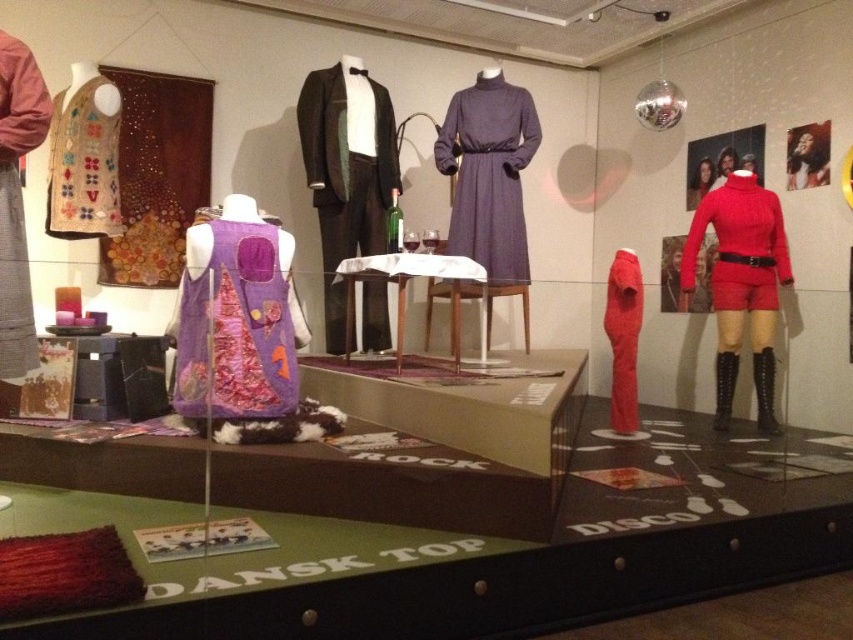
Does shiny black tuxedo at center have a smaller size compared to textured wool vest at left?

Incorrect, shiny black tuxedo at center is not smaller in size than textured wool vest at left.

Is point (376, 221) less distant than point (10, 241)?

No, it is not.

Identify the location of shiny black tuxedo at center. This screenshot has height=640, width=853. (346, 172).

Find the location of a particular element. The width and height of the screenshot is (853, 640). purple felt dress at center is located at coordinates (236, 330).

Between point (260, 252) and point (463, 246), which one is positioned in front?

Positioned in front is point (260, 252).

Which is behind, point (225, 292) or point (494, 81)?

The point (494, 81) is behind.

Where is `purple felt dress at center`? Image resolution: width=853 pixels, height=640 pixels. purple felt dress at center is located at coordinates (236, 330).

Looking at this image, can you confirm if purple felt dress at center is positioned above textured wool vest at left?

Incorrect, purple felt dress at center is not positioned above textured wool vest at left.

Which is more to the right, purple felt dress at center or textured wool vest at left?

From the viewer's perspective, purple felt dress at center appears more on the right side.

What do you see at coordinates (236, 330) in the screenshot? The width and height of the screenshot is (853, 640). I see `purple felt dress at center` at bounding box center [236, 330].

This screenshot has width=853, height=640. I want to click on purple felt dress at center, so click(x=236, y=330).